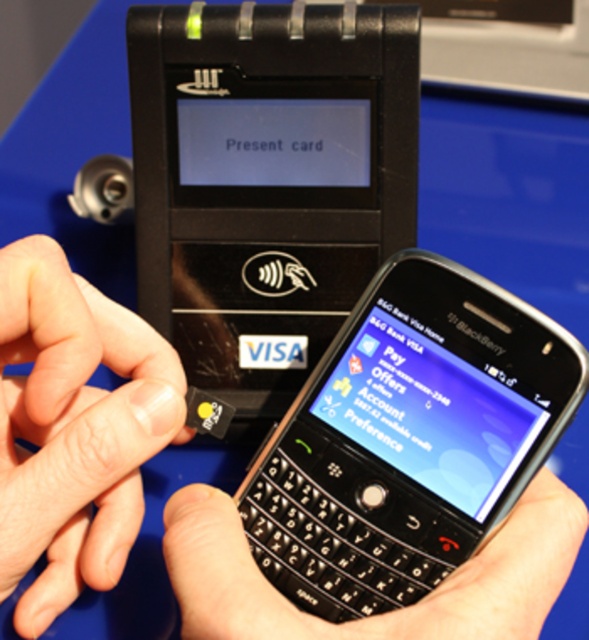
Who is more forward, (515, 474) or (2, 582)?

Point (2, 582) is in front.

You are a GUI agent. You are given a task and a screenshot of the screen. Output one action in this format:
    pyautogui.click(x=<x>, y=<y>)
    Task: Click on the black plastic smartphone at center
    
    Given the screenshot: What is the action you would take?
    pyautogui.click(x=408, y=438)

Between flesh-toned skin at center and black matte keyboard at center, which one has less height?

black matte keyboard at center is shorter.

Is flesh-toned skin at center further to camera compared to black matte keyboard at center?

Yes, flesh-toned skin at center is further from the viewer.

You are a GUI agent. You are given a task and a screenshot of the screen. Output one action in this format:
    pyautogui.click(x=<x>, y=<y>)
    Task: Click on the flesh-toned skin at center
    
    Given the screenshot: What is the action you would take?
    pyautogui.click(x=74, y=429)

The width and height of the screenshot is (589, 640). Identify the location of black plastic smartphone at center. (408, 438).

Between point (393, 390) and point (219, 531), which one is positioned in front?

Point (219, 531)

You are a GUI agent. You are given a task and a screenshot of the screen. Output one action in this format:
    pyautogui.click(x=<x>, y=<y>)
    Task: Click on the black plastic smartphone at center
    
    Given the screenshot: What is the action you would take?
    pyautogui.click(x=408, y=438)